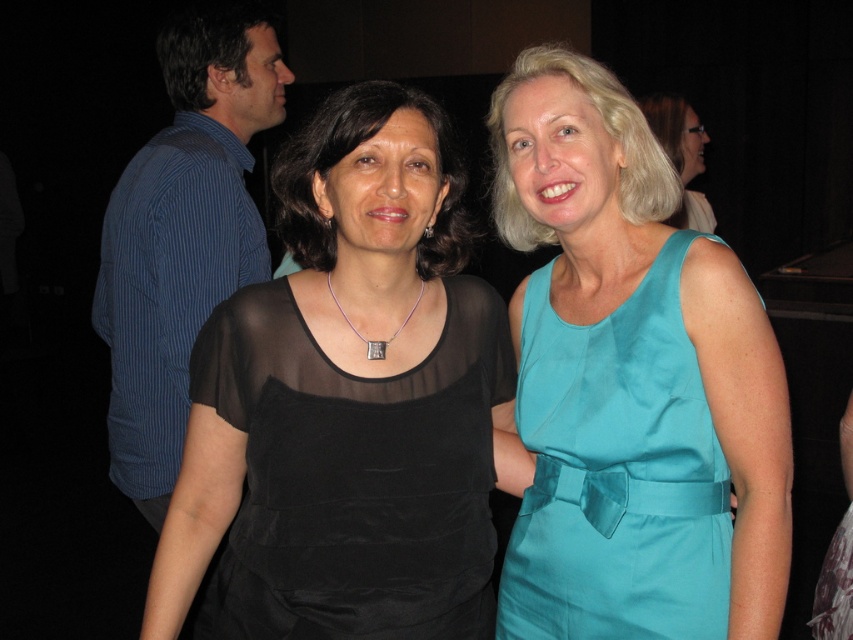
Does teal satin dress at upper right appear on the right side of silver metallic square at center?

Indeed, teal satin dress at upper right is positioned on the right side of silver metallic square at center.

Which is in front, point (706, 220) or point (396, 333)?

Positioned in front is point (396, 333).

Which is in front, point (670, 100) or point (358, 333)?

Point (358, 333) is in front.

Identify the location of teal satin dress at upper right. (676, 132).

Does sheer black dress at center appear over teal satin dress at upper right?

Incorrect, sheer black dress at center is not positioned above teal satin dress at upper right.

Is point (479, 390) closer to camera compared to point (712, 228)?

Yes, point (479, 390) is in front of point (712, 228).

Who is more distant from viewer, [386,595] or [686,109]?

Answer: The point [686,109] is more distant.

The height and width of the screenshot is (640, 853). I want to click on sheer black dress at center, so click(x=355, y=474).

Is teal satin dress at right wider than teal satin dress at upper right?

Yes.

Where is `teal satin dress at right`? teal satin dress at right is located at coordinates (618, 474).

I want to click on teal satin dress at right, so pos(618,474).